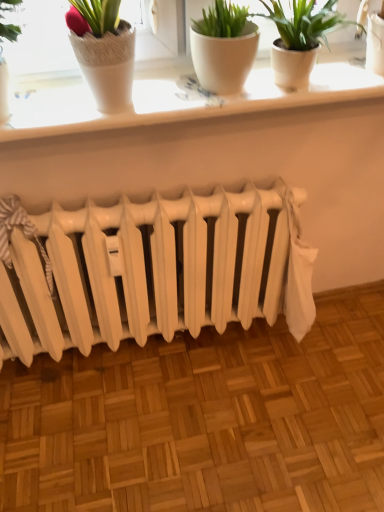
Question: From a real-world perspective, is white matte flowerpot at upper center below white ceramic window sill at upper center?

Choices:
 (A) yes
 (B) no

Answer: (B)

Question: Would you say white matte flowerpot at upper center is outside white ceramic window sill at upper center?

Choices:
 (A) no
 (B) yes

Answer: (B)

Question: From the image's perspective, is white matte flowerpot at upper center on top of white ceramic window sill at upper center?

Choices:
 (A) no
 (B) yes

Answer: (B)

Question: From a real-world perspective, is white matte flowerpot at upper center positioned over white ceramic window sill at upper center based on gravity?

Choices:
 (A) no
 (B) yes

Answer: (B)

Question: Does white matte flowerpot at upper center have a greater height compared to white ceramic window sill at upper center?

Choices:
 (A) no
 (B) yes

Answer: (B)

Question: In terms of height, does white matte radiator at center look taller or shorter compared to white matte flowerpot at upper center?

Choices:
 (A) tall
 (B) short

Answer: (A)

Question: Is point (226, 232) positioned closer to the camera than point (218, 82)?

Choices:
 (A) closer
 (B) farther

Answer: (B)

Question: From the image's perspective, is white matte radiator at center above or below white matte flowerpot at upper center?

Choices:
 (A) below
 (B) above

Answer: (A)

Question: Considering their positions, is white matte radiator at center located in front of or behind white matte flowerpot at upper center?

Choices:
 (A) front
 (B) behind

Answer: (B)

Question: Considering the positions of white matte flowerpot at upper center and white matte radiator at center in the image, is white matte flowerpot at upper center wider or thinner than white matte radiator at center?

Choices:
 (A) wide
 (B) thin

Answer: (B)

Question: Based on their sizes in the image, would you say white matte flowerpot at upper center is bigger or smaller than white matte radiator at center?

Choices:
 (A) big
 (B) small

Answer: (B)

Question: Is white matte flowerpot at upper center inside or outside of white matte radiator at center?

Choices:
 (A) outside
 (B) inside

Answer: (A)

Question: Considering the positions of point (241, 70) and point (23, 361), is point (241, 70) closer or farther from the camera than point (23, 361)?

Choices:
 (A) farther
 (B) closer

Answer: (B)

Question: Does point (170, 98) appear closer or farther from the camera than point (218, 65)?

Choices:
 (A) farther
 (B) closer

Answer: (A)

Question: From the image's perspective, is white ceramic window sill at upper center located above or below white matte flowerpot at upper center?

Choices:
 (A) below
 (B) above

Answer: (A)